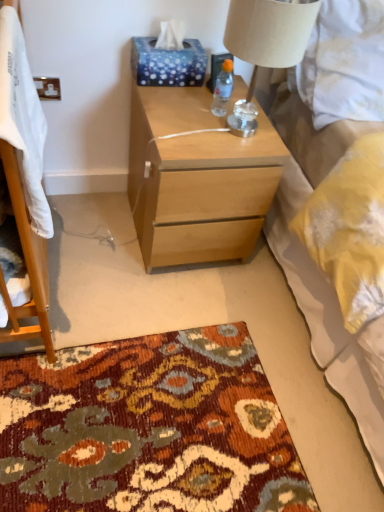
This screenshot has height=512, width=384. What are the coordinates of `free area in between blue dotted tissue at upper center and transparent plastic bottle at upper center` in the screenshot? It's located at (184, 95).